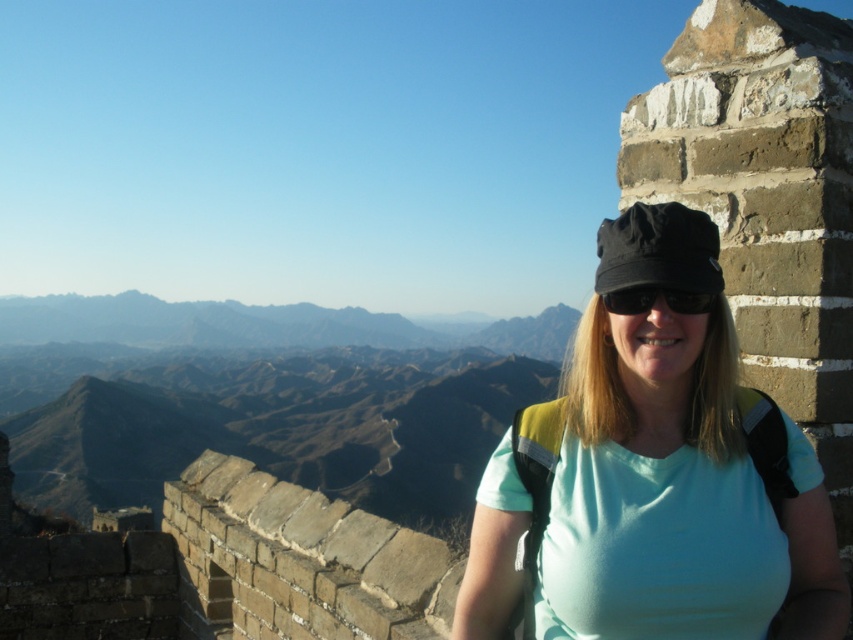
Question: Is matte black cap at upper right smaller than black matte sunglasses at center?

Choices:
 (A) no
 (B) yes

Answer: (A)

Question: Among these objects, which one is farthest from the camera?

Choices:
 (A) matte black cap at upper right
 (B) black matte sunglasses at center

Answer: (B)

Question: Does matte black cap at upper right have a larger size compared to black matte sunglasses at center?

Choices:
 (A) no
 (B) yes

Answer: (B)

Question: Does matte black cap at upper right appear under black matte sunglasses at center?

Choices:
 (A) no
 (B) yes

Answer: (B)